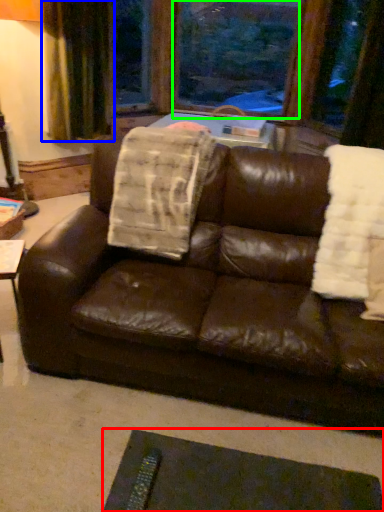
Question: Which object is positioned farthest from flat (highlighted by a red box)? Select from curtain (highlighted by a blue box) and window screen (highlighted by a green box).

Choices:
 (A) curtain
 (B) window screen

Answer: (B)